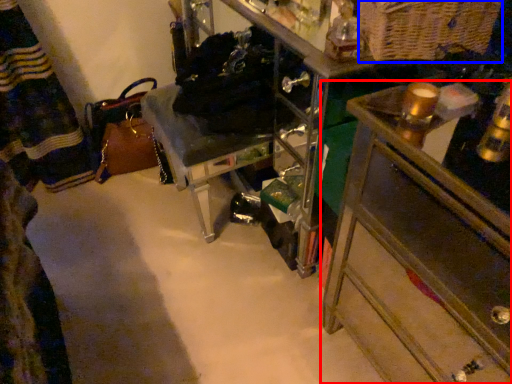
Question: Which point is further to the camera, chest of drawers (highlighted by a red box) or basket (highlighted by a blue box)?

Choices:
 (A) chest of drawers
 (B) basket

Answer: (B)